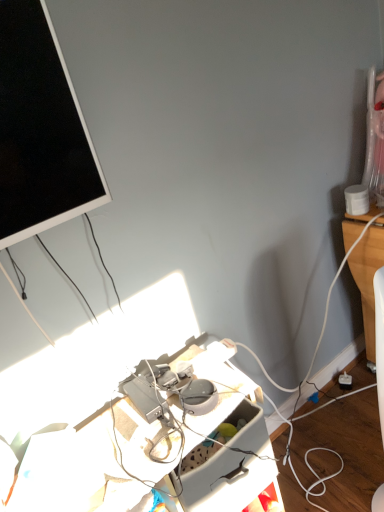
Question: Can you see plastic gray desk at center touching matte black screen at upper left?

Choices:
 (A) no
 (B) yes

Answer: (A)

Question: Could you tell me if plastic gray desk at center is turned towards matte black screen at upper left?

Choices:
 (A) yes
 (B) no

Answer: (B)

Question: Is plastic gray desk at center shorter than matte black screen at upper left?

Choices:
 (A) yes
 (B) no

Answer: (A)

Question: From a real-world perspective, does plastic gray desk at center sit lower than matte black screen at upper left?

Choices:
 (A) yes
 (B) no

Answer: (A)

Question: From the image's perspective, is plastic gray desk at center located above matte black screen at upper left?

Choices:
 (A) no
 (B) yes

Answer: (A)

Question: Considering their positions, is matte black screen at upper left located in front of or behind white plastic power outlet at lower right?

Choices:
 (A) front
 (B) behind

Answer: (A)

Question: Considering the positions of matte black screen at upper left and white plastic power outlet at lower right in the image, is matte black screen at upper left wider or thinner than white plastic power outlet at lower right?

Choices:
 (A) wide
 (B) thin

Answer: (A)

Question: In terms of size, does matte black screen at upper left appear bigger or smaller than white plastic power outlet at lower right?

Choices:
 (A) small
 (B) big

Answer: (B)

Question: Would you say matte black screen at upper left is to the left or to the right of white plastic power outlet at lower right in the picture?

Choices:
 (A) left
 (B) right

Answer: (A)

Question: Is white plastic power outlet at lower right taller or shorter than plastic gray desk at center?

Choices:
 (A) short
 (B) tall

Answer: (B)

Question: Considering the positions of white plastic power outlet at lower right and plastic gray desk at center in the image, is white plastic power outlet at lower right wider or thinner than plastic gray desk at center?

Choices:
 (A) wide
 (B) thin

Answer: (B)

Question: From a real-world perspective, is white plastic power outlet at lower right physically located above or below plastic gray desk at center?

Choices:
 (A) above
 (B) below

Answer: (B)

Question: Does point (349, 376) appear closer or farther from the camera than point (132, 403)?

Choices:
 (A) closer
 (B) farther

Answer: (B)

Question: Considering the relative positions of white plastic power outlet at lower right and matte black screen at upper left in the image provided, is white plastic power outlet at lower right to the left or to the right of matte black screen at upper left?

Choices:
 (A) right
 (B) left

Answer: (A)

Question: Is white plastic power outlet at lower right bigger or smaller than matte black screen at upper left?

Choices:
 (A) big
 (B) small

Answer: (B)